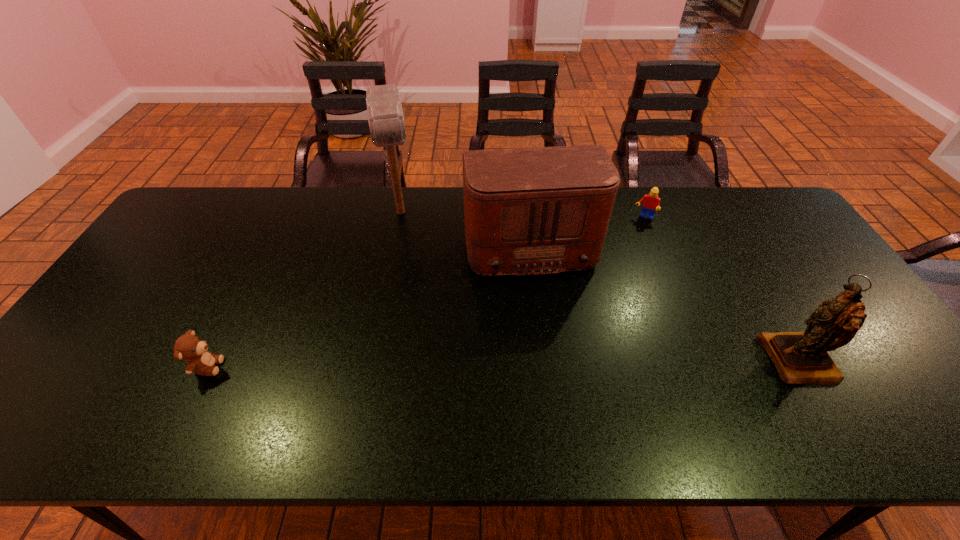
You are a GUI agent. You are given a task and a screenshot of the screen. Output one action in this format:
    pyautogui.click(x=<x>, y=<y>)
    Task: Click on the mallet located at the far edge
    
    Given the screenshot: What is the action you would take?
    pyautogui.click(x=385, y=116)

The image size is (960, 540). What are the coordinates of `Lego that is positioned at the far edge` in the screenshot? It's located at (652, 202).

Find the location of `teddy bear positioned at the near edge`. teddy bear positioned at the near edge is located at coordinates tap(189, 347).

The image size is (960, 540). What are the coordinates of `figurine located in the near edge section of the desktop` in the screenshot? It's located at [801, 357].

Where is `object positioned at the right edge`? This screenshot has height=540, width=960. object positioned at the right edge is located at coordinates (801, 357).

The image size is (960, 540). I want to click on object at the near right corner, so click(x=801, y=357).

Locate an element on the screen. The image size is (960, 540). free spot at the far edge of the desktop is located at coordinates (297, 205).

Locate an element on the screen. vacant space at the near edge of the desktop is located at coordinates (565, 392).

Where is `blank space at the left edge of the desktop`? blank space at the left edge of the desktop is located at coordinates (201, 238).

This screenshot has width=960, height=540. Find the location of `vacant space at the right edge of the desktop`. vacant space at the right edge of the desktop is located at coordinates (785, 262).